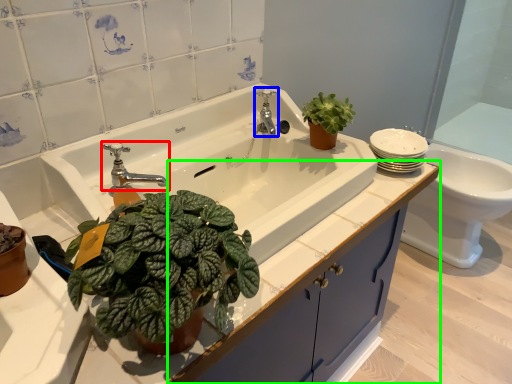
Question: Considering the real-world distances, which object is closest to tap (highlighted by a red box)? tap (highlighted by a blue box) or bathroom cabinet (highlighted by a green box).

Choices:
 (A) tap
 (B) bathroom cabinet

Answer: (A)